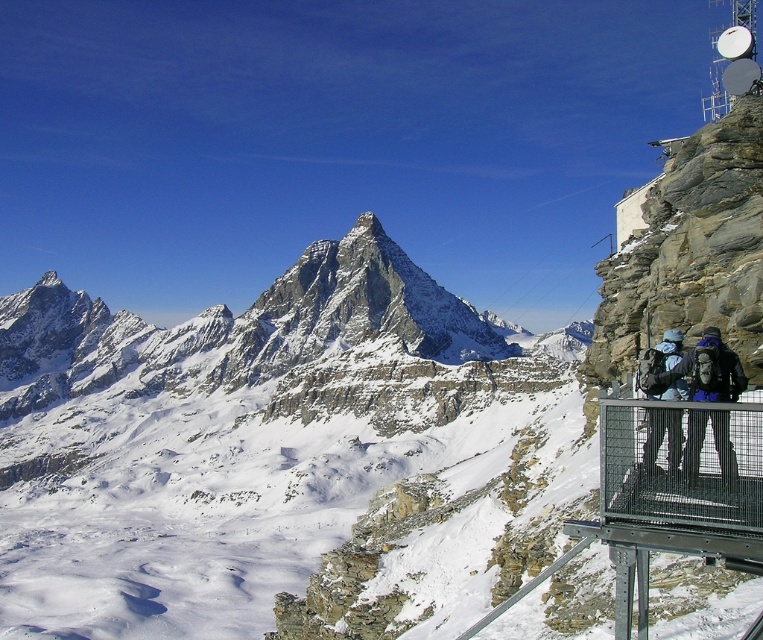
Question: Can you confirm if dark gray backpack at right is thinner than dark blue fabric backpack at right?

Choices:
 (A) yes
 (B) no

Answer: (A)

Question: Which point is closer to the camera?

Choices:
 (A) dark blue fabric backpack at right
 (B) dark gray backpack at right

Answer: (B)

Question: Is dark gray backpack at right wider than dark blue fabric backpack at right?

Choices:
 (A) no
 (B) yes

Answer: (A)

Question: Considering the relative positions of dark gray backpack at right and dark blue fabric backpack at right in the image provided, where is dark gray backpack at right located with respect to dark blue fabric backpack at right?

Choices:
 (A) left
 (B) right

Answer: (B)